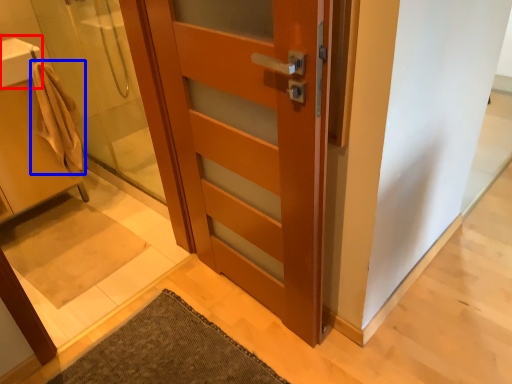
Question: Which of the following is the farthest to the observer, sink (highlighted by a red box) or bathrobe (highlighted by a blue box)?

Choices:
 (A) sink
 (B) bathrobe

Answer: (B)